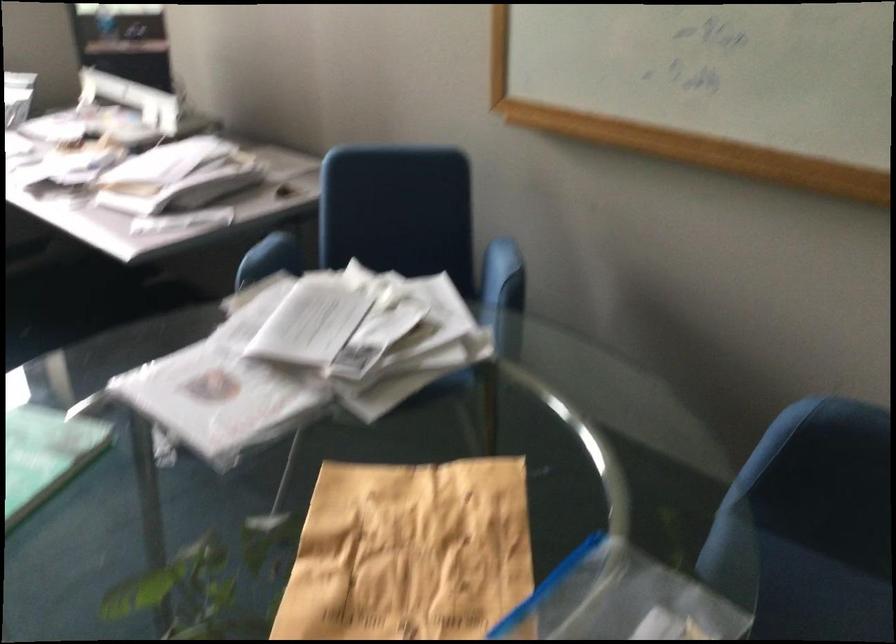
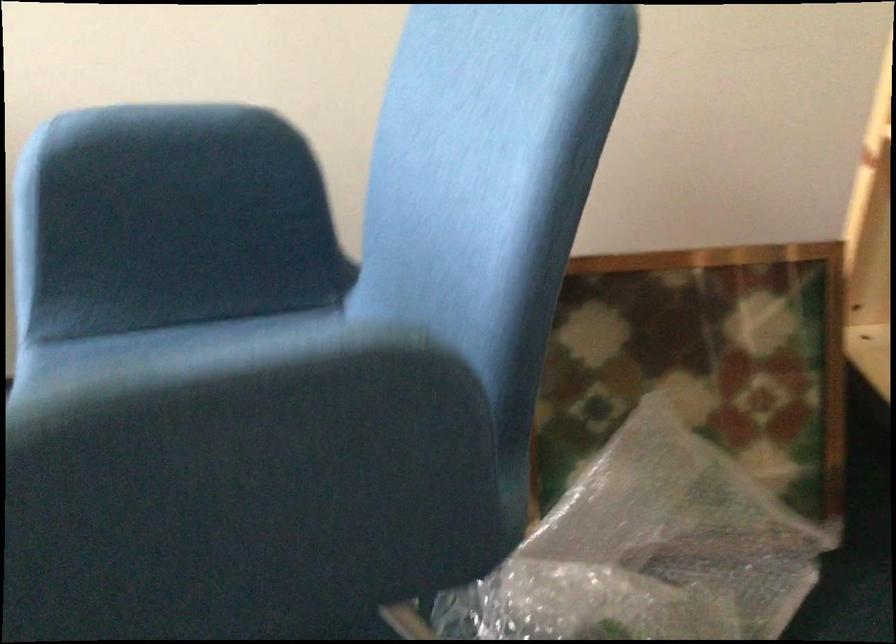
Question: The first image is from the beginning of the video and the second image is from the end. How did the camera likely rotate when shooting the video?

Choices:
 (A) Left
 (B) Right
 (C) Up
 (D) Down

Answer: (B)